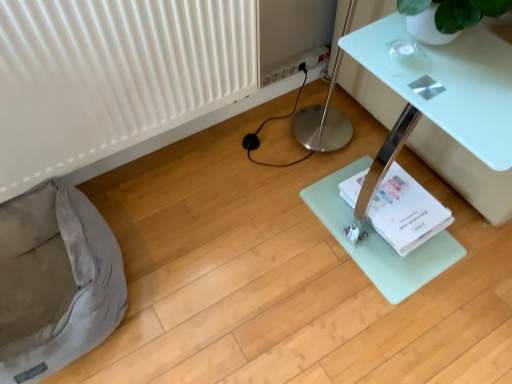
Question: Does white ribbed radiator at lower left contain white plastic power strip at upper center?

Choices:
 (A) no
 (B) yes

Answer: (A)

Question: Considering the relative sizes of white ribbed radiator at lower left and white plastic power strip at upper center in the image provided, is white ribbed radiator at lower left shorter than white plastic power strip at upper center?

Choices:
 (A) no
 (B) yes

Answer: (A)

Question: Is white ribbed radiator at lower left thinner than white plastic power strip at upper center?

Choices:
 (A) no
 (B) yes

Answer: (A)

Question: Considering the relative sizes of white ribbed radiator at lower left and white plastic power strip at upper center in the image provided, is white ribbed radiator at lower left wider than white plastic power strip at upper center?

Choices:
 (A) yes
 (B) no

Answer: (A)

Question: Considering the relative sizes of white ribbed radiator at lower left and white plastic power strip at upper center in the image provided, is white ribbed radiator at lower left taller than white plastic power strip at upper center?

Choices:
 (A) no
 (B) yes

Answer: (B)

Question: Does point (69, 259) appear closer or farther from the camera than point (382, 114)?

Choices:
 (A) farther
 (B) closer

Answer: (B)

Question: In terms of width, does gray fabric bean bag at lower left look wider or thinner when compared to white glossy table at lower right?

Choices:
 (A) thin
 (B) wide

Answer: (A)

Question: Visually, is gray fabric bean bag at lower left positioned to the left or to the right of white glossy table at lower right?

Choices:
 (A) left
 (B) right

Answer: (A)

Question: Relative to white glossy table at lower right, is gray fabric bean bag at lower left in front or behind?

Choices:
 (A) front
 (B) behind

Answer: (B)

Question: Considering the positions of white ribbed radiator at lower left and gray fabric bean bag at lower left in the image, is white ribbed radiator at lower left taller or shorter than gray fabric bean bag at lower left?

Choices:
 (A) short
 (B) tall

Answer: (B)

Question: Does point (177, 28) appear closer or farther from the camera than point (33, 334)?

Choices:
 (A) closer
 (B) farther

Answer: (B)

Question: In terms of width, does white ribbed radiator at lower left look wider or thinner when compared to gray fabric bean bag at lower left?

Choices:
 (A) thin
 (B) wide

Answer: (A)

Question: Based on their sizes in the image, would you say white ribbed radiator at lower left is bigger or smaller than gray fabric bean bag at lower left?

Choices:
 (A) small
 (B) big

Answer: (A)

Question: Would you say white paper at lower right is inside or outside white glossy table at lower right?

Choices:
 (A) outside
 (B) inside

Answer: (A)

Question: Considering the positions of white paper at lower right and white glossy table at lower right in the image, is white paper at lower right wider or thinner than white glossy table at lower right?

Choices:
 (A) wide
 (B) thin

Answer: (B)